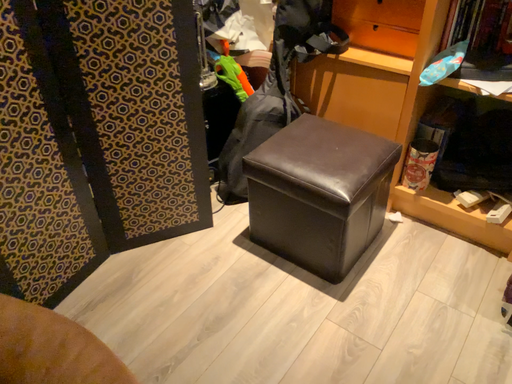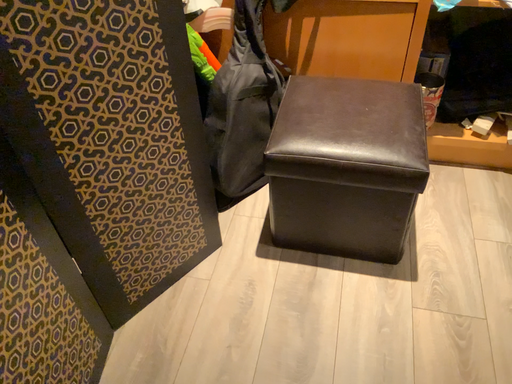
Question: Which way did the camera rotate in the video?

Choices:
 (A) rotated left
 (B) rotated right

Answer: (B)